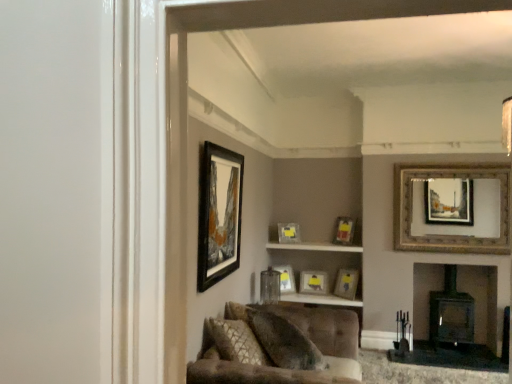
This screenshot has height=384, width=512. What do you see at coordinates (344, 230) in the screenshot?
I see `matte gold picture frame at center, the 3th picture frame from the right` at bounding box center [344, 230].

You are a GUI agent. You are given a task and a screenshot of the screen. Output one action in this format:
    pyautogui.click(x=<x>, y=<y>)
    Task: Click on the matte glass cabinet at center
    This screenshot has height=384, width=512.
    Given the screenshot: What is the action you would take?
    pyautogui.click(x=314, y=247)

Where is `tufted fabric couch at lower center`? The width and height of the screenshot is (512, 384). tufted fabric couch at lower center is located at coordinates (267, 354).

What do you see at coordinates (346, 283) in the screenshot?
I see `wooden picture frame at center, the 2th picture frame in the right-to-left sequence` at bounding box center [346, 283].

The height and width of the screenshot is (384, 512). Describe the element at coordinates (314, 282) in the screenshot. I see `matte gold picture frame at center, which appears as the sixth picture frame when viewed from the front` at that location.

Identify the location of matte gold picture frame at center, which is counted as the 4th picture frame, starting from the back. (344, 230).

Are matte gold picture frame at center, which is counted as the 5th picture frame, starting from the right, and matte gold picture frame at center, which is the fourth picture frame from left to right, beside each other?

matte gold picture frame at center, which is counted as the 5th picture frame, starting from the right, and matte gold picture frame at center, which is the fourth picture frame from left to right, are clearly separated.

From the picture: Is matte gold picture frame at center, the first picture frame from the back, completely or partially outside of matte gold picture frame at center, which is the fourth picture frame from left to right?

matte gold picture frame at center, the first picture frame from the back, is positioned outside matte gold picture frame at center, which is the fourth picture frame from left to right.

Which object is closer to the camera, matte gold picture frame at center, which is counted as the 5th picture frame, starting from the right, or matte gold picture frame at center, which is the fourth picture frame from left to right?

matte gold picture frame at center, which is the fourth picture frame from left to right, is more forward.

Which object is positioned more to the left, matte gold picture frame at center, which is counted as the 5th picture frame, starting from the right, or matte gold picture frame at center, arranged as the 4th picture frame when viewed from the right?

From the viewer's perspective, matte gold picture frame at center, which is counted as the 5th picture frame, starting from the right, appears more on the left side.

Visually, is matte gold picture frame at center, the first picture frame from the back, positioned to the left or to the right of gold/gilded picture frame at upper right, the 1th picture frame from the right?

Based on their positions, matte gold picture frame at center, the first picture frame from the back, is located to the left of gold/gilded picture frame at upper right, the 1th picture frame from the right.

Which is farther, [278,231] or [402,250]?

The point [278,231] is farther.

Considering the positions of objects matte gold picture frame at center, the first picture frame from the back, and gold/gilded picture frame at upper right, the 1th picture frame from the right, in the image provided, who is behind, matte gold picture frame at center, the first picture frame from the back, or gold/gilded picture frame at upper right, the 1th picture frame from the right,?

matte gold picture frame at center, the first picture frame from the back.

What's the angular difference between matte gold picture frame at center, the 3th picture frame viewed from the left, and gold/gilded picture frame at upper right, the 1th picture frame from the right,'s facing directions?

The facing directions of matte gold picture frame at center, the 3th picture frame viewed from the left, and gold/gilded picture frame at upper right, the 1th picture frame from the right, are 33.9 degrees apart.

Between point (341, 283) and point (292, 269), which one is positioned behind?

The point (292, 269) is more distant.

From a real-world perspective, is wooden picture frame at center, acting as the fifth picture frame starting from the back, positioned over matte glass picture frame at center, positioned as the third picture frame in back-to-front order, based on gravity?

Incorrect, from a real-world perspective, wooden picture frame at center, acting as the fifth picture frame starting from the back, is lower than matte glass picture frame at center, positioned as the third picture frame in back-to-front order.

Looking at this image, can you tell me how much wooden picture frame at center, the 2th picture frame in the right-to-left sequence, and matte glass picture frame at center, acting as the second picture frame starting from the left, differ in facing direction?

There is a 82.1-degree angle between the facing directions of wooden picture frame at center, the 2th picture frame in the right-to-left sequence, and matte glass picture frame at center, acting as the second picture frame starting from the left.

From the image's perspective, is wooden picture frame at center, the 2th picture frame in the right-to-left sequence, located above matte glass picture frame at center, acting as the fifth picture frame starting from the front?

No, from the image's perspective, wooden picture frame at center, the 2th picture frame in the right-to-left sequence, is not over matte glass picture frame at center, acting as the fifth picture frame starting from the front.

Considering the relative sizes of matte gold picture frame at center, positioned as the 4th picture frame in front-to-back order, and matte glass picture frame at center, acting as the second picture frame starting from the left, in the image provided, is matte gold picture frame at center, positioned as the 4th picture frame in front-to-back order, bigger than matte glass picture frame at center, acting as the second picture frame starting from the left,?

Yes, matte gold picture frame at center, positioned as the 4th picture frame in front-to-back order, is bigger than matte glass picture frame at center, acting as the second picture frame starting from the left.

Is matte gold picture frame at center, acting as the fifth picture frame starting from the left, wider or thinner than matte glass picture frame at center, positioned as the third picture frame in back-to-front order?

Clearly, matte gold picture frame at center, acting as the fifth picture frame starting from the left, has more width compared to matte glass picture frame at center, positioned as the third picture frame in back-to-front order.

Is matte gold picture frame at center, positioned as the 4th picture frame in front-to-back order, oriented away from matte glass picture frame at center, acting as the second picture frame starting from the left?

No, matte gold picture frame at center, positioned as the 4th picture frame in front-to-back order,'s orientation is not away from matte glass picture frame at center, acting as the second picture frame starting from the left.

In the scene shown: Which is less distant, (342,289) or (438,239)?

The point (438,239) is closer to the camera.

Is wooden picture frame at center, the sixth picture frame in the left-to-right sequence, facing towards gold/gilded picture frame at upper right, the 1th picture frame from the right?

No, wooden picture frame at center, the sixth picture frame in the left-to-right sequence, does not turn towards gold/gilded picture frame at upper right, the 1th picture frame from the right.

Is the surface of wooden picture frame at center, the third picture frame viewed from the front, in direct contact with gold/gilded picture frame at upper right, the sixth picture frame in the back-to-front sequence?

They are not placed beside each other.

From the image's perspective, which one is positioned higher, wooden picture frame at center, acting as the fifth picture frame starting from the back, or gold/gilded picture frame at upper right, which is the 2th picture frame from front to back?

gold/gilded picture frame at upper right, which is the 2th picture frame from front to back.

Between matte gold picture frame at center, the 3th picture frame from the right, and matte gold picture frame at center, which is counted as the 5th picture frame, starting from the right, which one has smaller width?

matte gold picture frame at center, which is counted as the 5th picture frame, starting from the right, is thinner.

Considering the points (354, 222) and (288, 235), which point is in front, point (354, 222) or point (288, 235)?

The point (288, 235) is closer to the camera.

Is matte gold picture frame at center, acting as the fifth picture frame starting from the left, far from matte gold picture frame at center, the 3th picture frame viewed from the left?

Actually, matte gold picture frame at center, acting as the fifth picture frame starting from the left, and matte gold picture frame at center, the 3th picture frame viewed from the left, are a little close together.

Which is behind, matte gold picture frame at center, which is counted as the 4th picture frame, starting from the back, or matte gold picture frame at center, the first picture frame from the back?

matte gold picture frame at center, the first picture frame from the back.

Is velvet textured pillow at lower center wider or thinner than wooden picture frame at center, the third picture frame viewed from the front?

Clearly, velvet textured pillow at lower center has more width compared to wooden picture frame at center, the third picture frame viewed from the front.

From a real-world perspective, is velvet textured pillow at lower center positioned over wooden picture frame at center, the sixth picture frame in the left-to-right sequence, based on gravity?

No, from a real-world perspective, velvet textured pillow at lower center is not above wooden picture frame at center, the sixth picture frame in the left-to-right sequence.

Is point (255, 316) closer or farther from the camera than point (334, 289)?

Point (255, 316) is positioned closer to the camera compared to point (334, 289).

The height and width of the screenshot is (384, 512). Find the location of `picture frame that is the 1st object to the left of the matte gold picture frame at center, arranged as the 4th picture frame when viewed from the right, starting at the anchor`. picture frame that is the 1st object to the left of the matte gold picture frame at center, arranged as the 4th picture frame when viewed from the right, starting at the anchor is located at coordinates (289, 233).

Where is `picture frame that is the 4th object to the right of the matte gold picture frame at center, the 3th picture frame viewed from the left, starting at the anchor`? picture frame that is the 4th object to the right of the matte gold picture frame at center, the 3th picture frame viewed from the left, starting at the anchor is located at coordinates (448, 235).

From the image, which object appears to be farther from matte glass picture frame at center, positioned as the third picture frame in back-to-front order, velvet textured pillow at lower center or matte glass cabinet at center?

velvet textured pillow at lower center is positioned further to the anchor matte glass picture frame at center, positioned as the third picture frame in back-to-front order.

Considering their positions, is tufted fabric couch at lower center positioned further to matte gold picture frame at center, the seventh picture frame positioned from the front, than matte gold picture frame at center, arranged as the 4th picture frame when viewed from the right?

Based on the image, tufted fabric couch at lower center appears to be further to matte gold picture frame at center, the seventh picture frame positioned from the front.

From the picture: Considering their positions, is matte gold picture frame at center, which appears as the sixth picture frame when viewed from the front, positioned further to matte glass cabinet at center than matte glass picture frame at center, positioned as the third picture frame in back-to-front order?

matte glass picture frame at center, positioned as the third picture frame in back-to-front order.

Looking at the image, which one is located further to matte gold picture frame at center, positioned as the second picture frame in back-to-front order, matte glass picture frame at center, acting as the second picture frame starting from the left, or gold/gilded picture frame at upper right, the 1th picture frame from the right?

Among the two, gold/gilded picture frame at upper right, the 1th picture frame from the right, is located further to matte gold picture frame at center, positioned as the second picture frame in back-to-front order.

From the image, which object appears to be farther from matte gold picture frame at center, arranged as the 4th picture frame when viewed from the right, gold/gilded picture frame at upper right, which is the 2th picture frame from front to back, or velvet textured pillow at lower center?

velvet textured pillow at lower center is further to matte gold picture frame at center, arranged as the 4th picture frame when viewed from the right.

When comparing their distances from tufted fabric couch at lower center, does matte gold picture frame at center, arranged as the 4th picture frame when viewed from the right, or black matte picture frame at upper center, marked as the first picture frame in a left-to-right arrangement, seem closer?

black matte picture frame at upper center, marked as the first picture frame in a left-to-right arrangement, is closer to tufted fabric couch at lower center.

Based on their spatial positions, is black matte picture frame at upper center, acting as the 7th picture frame starting from the right, or velvet textured pillow at lower center further from tufted fabric couch at lower center?

black matte picture frame at upper center, acting as the 7th picture frame starting from the right, lies further to tufted fabric couch at lower center than the other object.

From the picture: Estimate the real-world distances between objects in this image. Which object is further from matte gold picture frame at center, acting as the fifth picture frame starting from the left, matte gold picture frame at center, which is counted as the 5th picture frame, starting from the right, or tufted fabric couch at lower center?

tufted fabric couch at lower center lies further to matte gold picture frame at center, acting as the fifth picture frame starting from the left, than the other object.

Find the location of a particular element. Image resolution: width=512 pixels, height=384 pixels. cabinet between black matte picture frame at upper center, acting as the 7th picture frame starting from the right, and gold/gilded picture frame at upper right, which ranks as the 7th picture frame in left-to-right order is located at coordinates (314, 247).

Locate an element on the screen. Image resolution: width=512 pixels, height=384 pixels. cabinet located between tufted fabric couch at lower center and matte glass picture frame at center, acting as the second picture frame starting from the left, in the depth direction is located at coordinates (314, 247).

Find the location of `cabinet between matte gold picture frame at center, the seventh picture frame positioned from the front, and gold/gilded picture frame at upper right, the 1th picture frame from the right, in the horizontal direction`. cabinet between matte gold picture frame at center, the seventh picture frame positioned from the front, and gold/gilded picture frame at upper right, the 1th picture frame from the right, in the horizontal direction is located at coordinates (314, 247).

Where is `cabinet between black matte picture frame at upper center, marked as the first picture frame in a left-to-right arrangement, and matte gold picture frame at center, which appears as the sixth picture frame when viewed from the front, in the front-back direction`? The height and width of the screenshot is (384, 512). cabinet between black matte picture frame at upper center, marked as the first picture frame in a left-to-right arrangement, and matte gold picture frame at center, which appears as the sixth picture frame when viewed from the front, in the front-back direction is located at coordinates (314, 247).